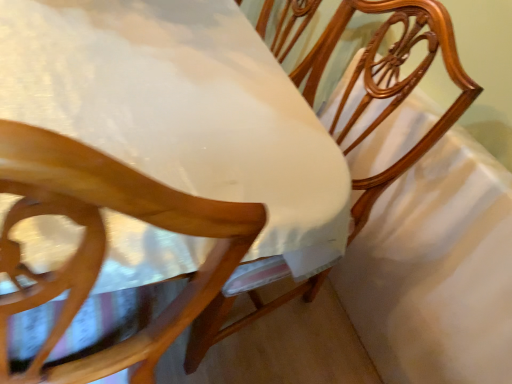
Question: From the image's perspective, would you say wooden chair at center is positioned over white satin sheet at center?

Choices:
 (A) no
 (B) yes

Answer: (B)

Question: Is wooden chair at center wider than white satin sheet at center?

Choices:
 (A) no
 (B) yes

Answer: (B)

Question: Is wooden chair at center far away from white satin sheet at center?

Choices:
 (A) no
 (B) yes

Answer: (A)

Question: Is white satin sheet at center at the back of wooden chair at center?

Choices:
 (A) no
 (B) yes

Answer: (B)

Question: Considering the relative positions of wooden chair at center and white satin sheet at center in the image provided, is wooden chair at center to the left of white satin sheet at center from the viewer's perspective?

Choices:
 (A) no
 (B) yes

Answer: (B)

Question: Does wooden chair at center have a greater height compared to white satin sheet at center?

Choices:
 (A) no
 (B) yes

Answer: (A)

Question: Considering the relative positions of white glossy table at center and wooden chair at center in the image provided, is white glossy table at center to the left of wooden chair at center from the viewer's perspective?

Choices:
 (A) yes
 (B) no

Answer: (A)

Question: Does white glossy table at center have a lesser height compared to wooden chair at center?

Choices:
 (A) yes
 (B) no

Answer: (B)

Question: From the image's perspective, is white glossy table at center beneath wooden chair at center?

Choices:
 (A) no
 (B) yes

Answer: (B)

Question: Does white glossy table at center appear on the right side of wooden chair at center?

Choices:
 (A) yes
 (B) no

Answer: (B)

Question: Is white glossy table at center in front of wooden chair at center?

Choices:
 (A) no
 (B) yes

Answer: (B)

Question: From a real-world perspective, is white glossy table at center physically below wooden chair at center?

Choices:
 (A) no
 (B) yes

Answer: (B)

Question: From a real-world perspective, is white glossy table at center below white satin sheet at center?

Choices:
 (A) yes
 (B) no

Answer: (B)